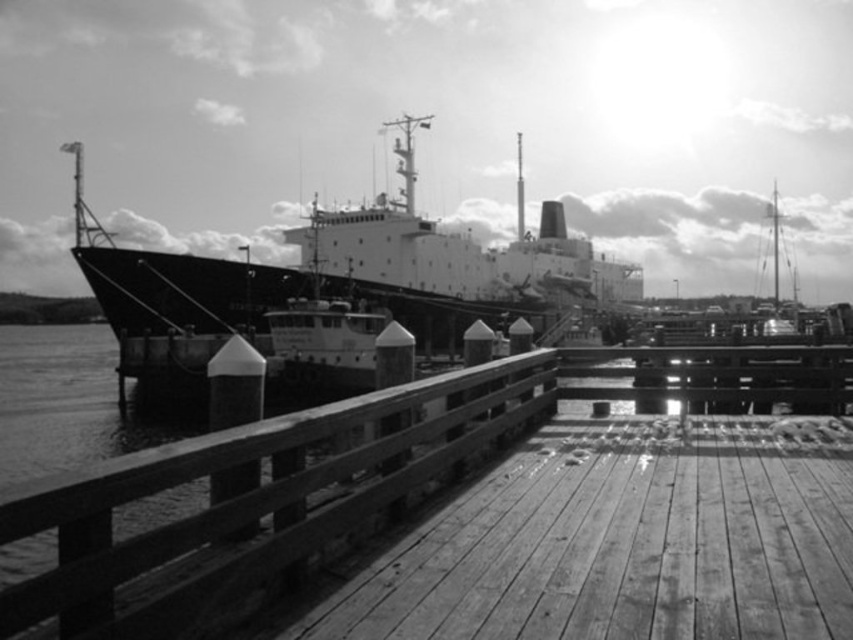
Question: Which object is closer to the camera taking this photo?

Choices:
 (A) smooth black cargo ship at center
 (B) wooden at center

Answer: (B)

Question: Does wooden at center appear over smooth black cargo ship at center?

Choices:
 (A) no
 (B) yes

Answer: (A)

Question: Does wooden at center have a smaller size compared to smooth black cargo ship at center?

Choices:
 (A) no
 (B) yes

Answer: (B)

Question: Which point is farther to the camera?

Choices:
 (A) wooden at center
 (B) smooth black cargo ship at center

Answer: (B)

Question: In this image, where is wooden at center located relative to smooth black cargo ship at center?

Choices:
 (A) left
 (B) right

Answer: (A)